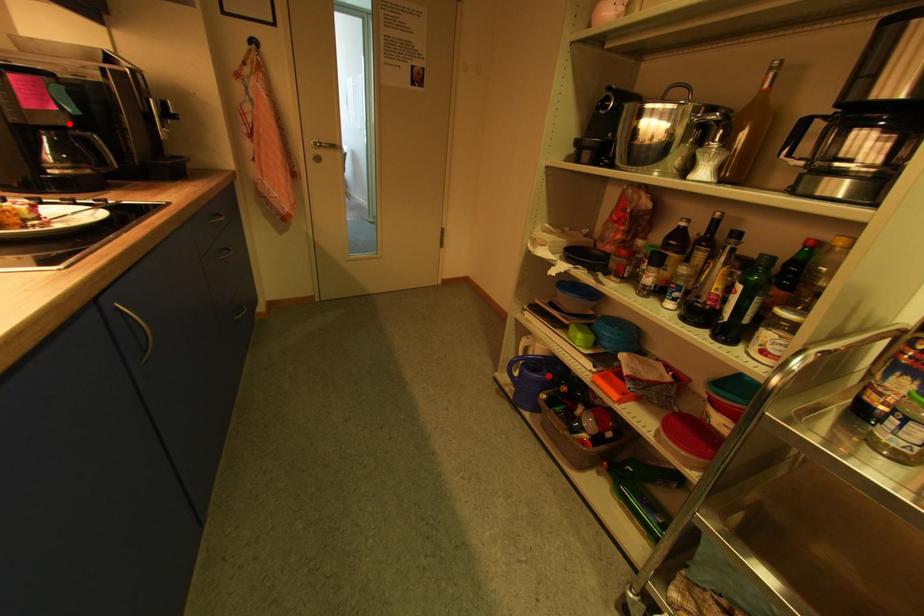
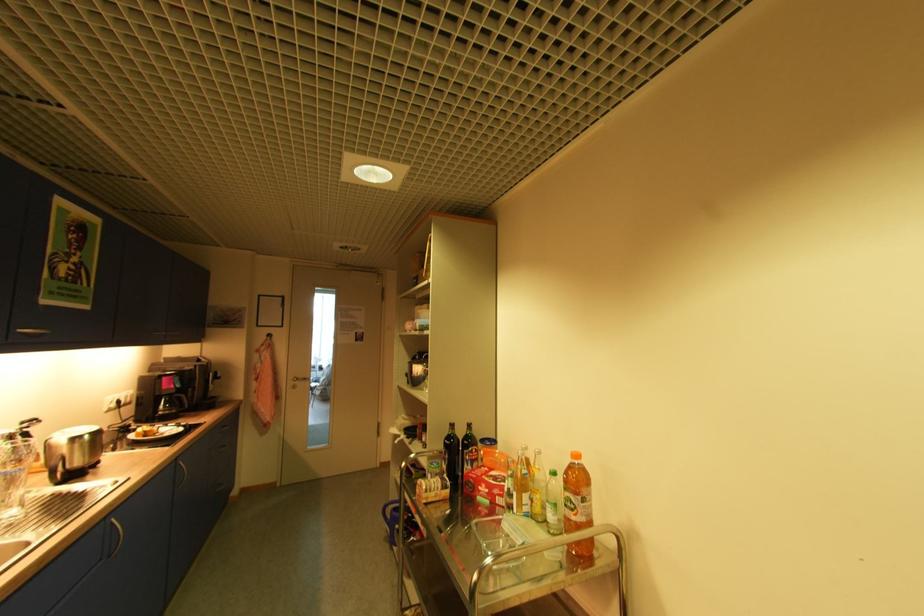
Locate, in the second image, the point that corresponds to the highlighted location in the first image.

(178, 392)